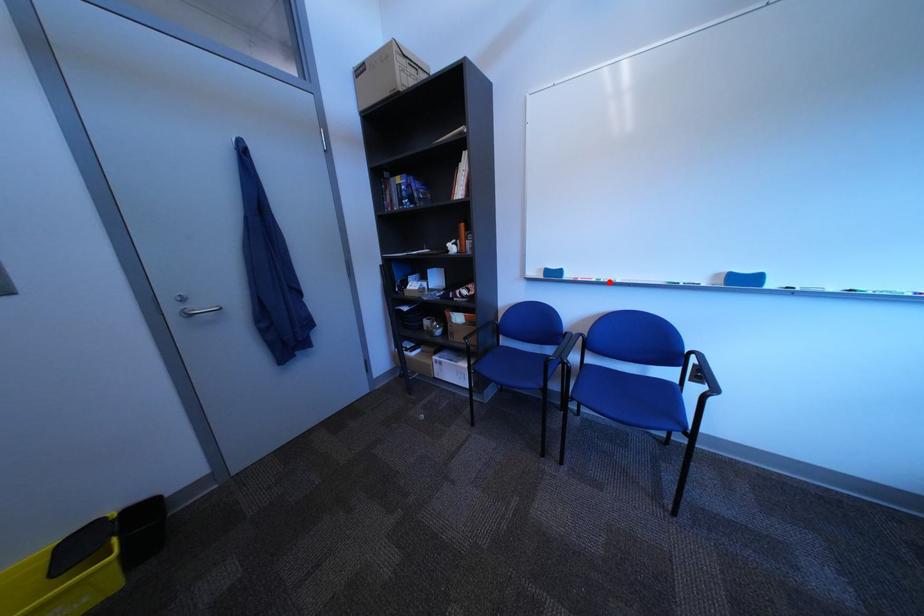
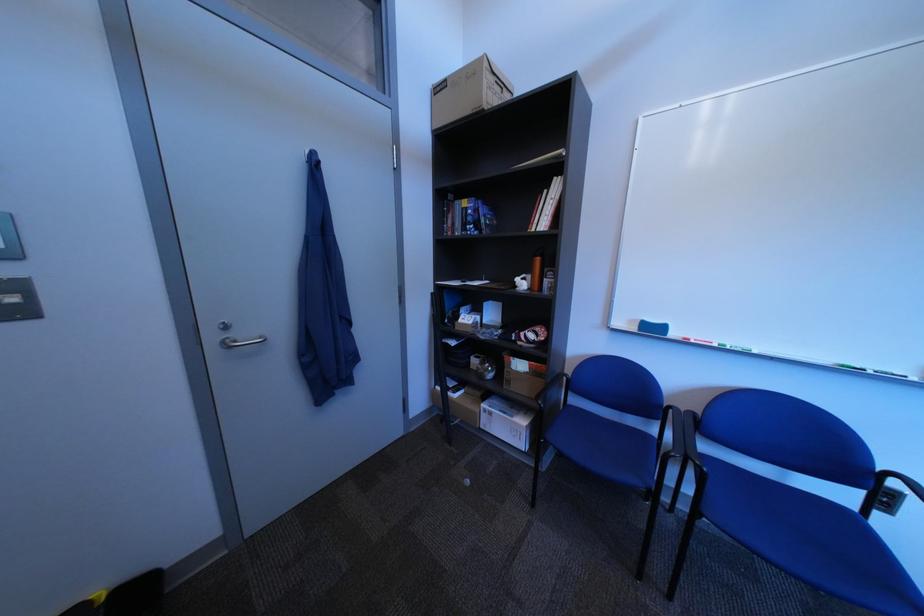
Question: I am providing you with two images of the same scene from different viewpoints. A red point is marked on the first image. Is the red point's position out of view in image 2?

Choices:
 (A) Yes
 (B) No

Answer: (B)